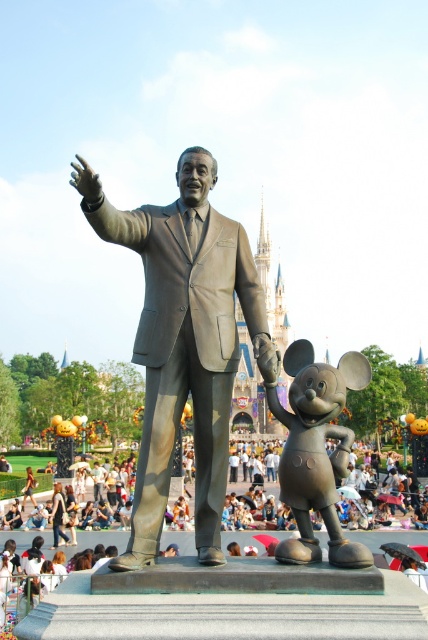
You are a park visitor standing at the entrance of the theme park. You want to take a photo of the bronze statue at center from a distance where it will be clearly visible without any obstruction. Given that the statue is at coordinates point 0.533, 0.430, what is the best direction to move to ensure the statue remains in your sightline while avoiding the crowd?

The bronze statue at center is located at point (184, 340). To keep it in your sightline while avoiding the crowd, move towards the area opposite the crowd concentration, ensuring the statue remains centered in your view.